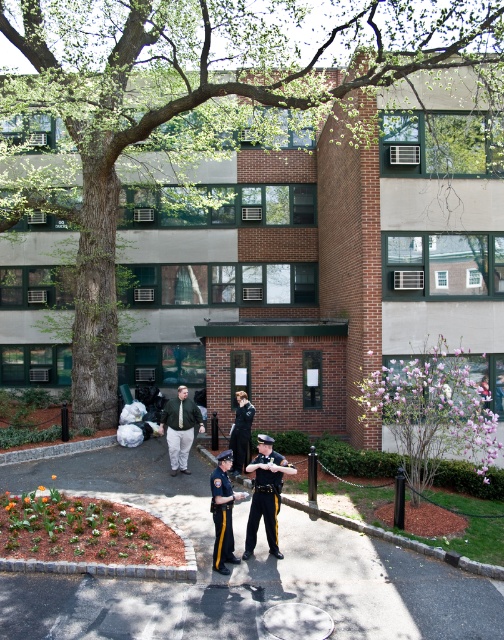
You are standing in front of the building and want to determine which of the two points, point (217, 556) or point (230, 444), is nearer to you. Based on the coordinates provided, which one is closer?

Point (217, 556) is closer to the viewer than point (230, 444).

You are a photographer trying to capture both the dark blue uniform at center and the shiny black uniform at center in a single frame. Which uniform should you focus on to ensure both are visible without moving the camera?

You should focus on the shiny black uniform at center since it occupies more space and will be easier to frame alongside the smaller dark blue uniform at center.